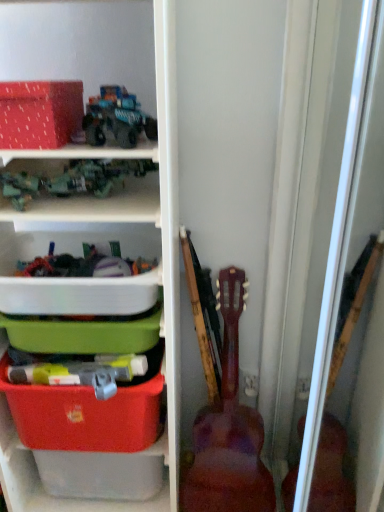
Question: Is wooden acoustic guitar at right inside or outside of teal matte truck at upper center, which is the first toy from top to bottom?

Choices:
 (A) outside
 (B) inside

Answer: (A)

Question: From their relative heights in the image, would you say wooden acoustic guitar at right is taller or shorter than teal matte truck at upper center, the second toy in the left-to-right sequence?

Choices:
 (A) tall
 (B) short

Answer: (A)

Question: Based on their relative distances, which object is nearer to the white plastic container at center, the second storage box from the top?

Choices:
 (A) wooden acoustic guitar at right
 (B) teal matte truck at upper center, acting as the 2th toy starting from the bottom
 (C) matte plastic storage bin at left
 (D) matte plastic storage box at lower left, acting as the 3th storage box starting from the top
 (E) metallic green toy truck at upper left, the first toy when ordered from left to right

Answer: (C)

Question: Estimate the real-world distances between objects in this image. Which object is farther from the teal matte truck at upper center, the second toy in the left-to-right sequence?

Choices:
 (A) white plastic container at center, which is the second storage box in bottom-to-top order
 (B) metallic green toy truck at upper left, the first toy when ordered from left to right
 (C) matte plastic storage bin at left
 (D) matte plastic storage box at lower left, acting as the 3th storage box starting from the top
 (E) matte red storage box at upper left, the 3th storage box positioned from the bottom

Answer: (D)